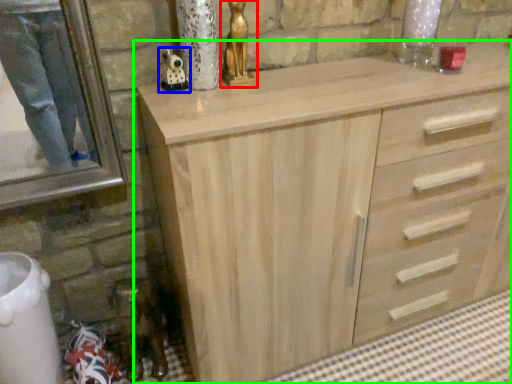
Question: Which object is the closest to the sculpture (highlighted by a red box)? Choose among these: miniature (highlighted by a blue box) or chest of drawers (highlighted by a green box).

Choices:
 (A) miniature
 (B) chest of drawers

Answer: (A)